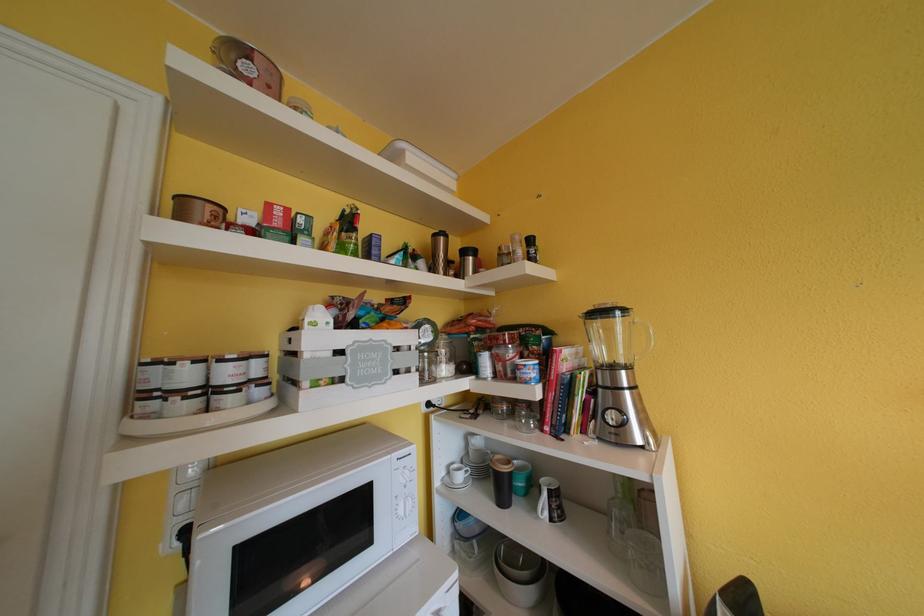
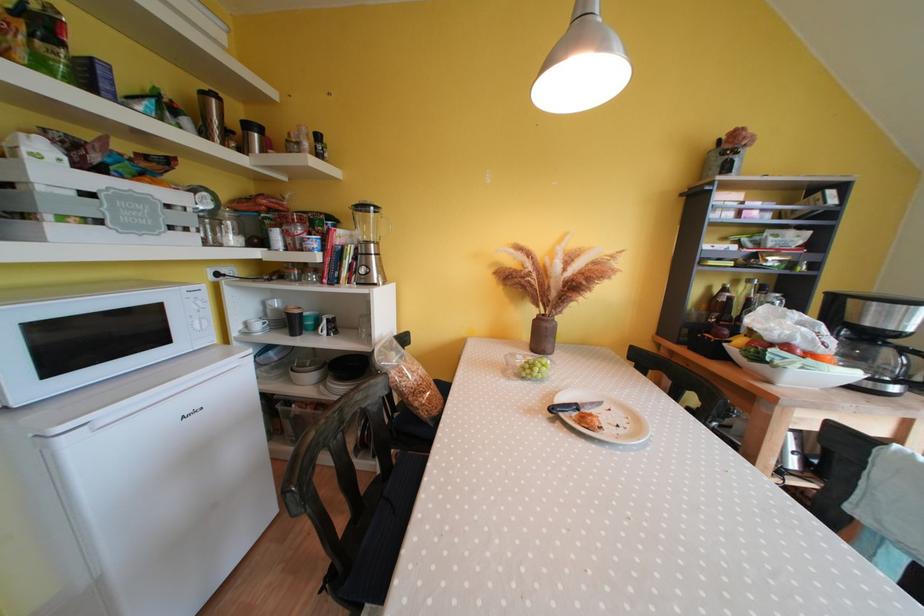
Find the pixel in the second image that matches point (442, 238) in the first image.

(209, 98)